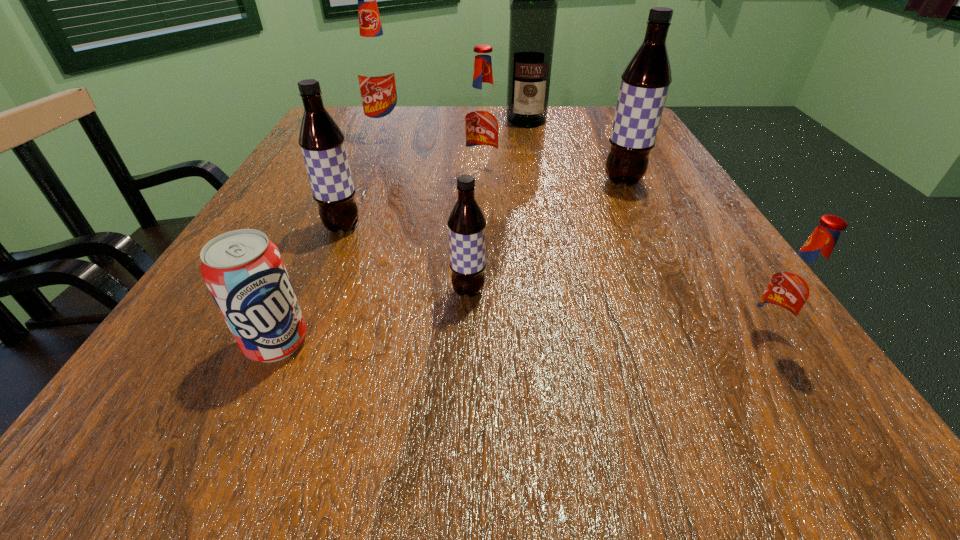
At what (x,y) coordinates should I click in order to perform the action: click on free region located 0.280m on the left of the nearest root beer. Please return your answer as a coordinate pair (x, y). Looking at the image, I should click on (529, 336).

Find the location of `vacant space located on the front of the second nearest root beer`. vacant space located on the front of the second nearest root beer is located at coordinates (467, 360).

You are a GUI agent. You are given a task and a screenshot of the screen. Output one action in this format:
    pyautogui.click(x=<x>, y=<y>)
    Task: Click on the free space located 0.060m on the back of the shortest object
    This screenshot has width=960, height=540.
    Given the screenshot: What is the action you would take?
    pyautogui.click(x=300, y=290)

Find the location of a particular element. alcohol at the far edge is located at coordinates (533, 10).

The width and height of the screenshot is (960, 540). I want to click on root beer at the far edge, so click(x=376, y=70).

Find the location of `soda can that is positioned at the left edge`. soda can that is positioned at the left edge is located at coordinates (244, 271).

This screenshot has width=960, height=540. I want to click on object that is at the far left corner, so click(x=376, y=70).

In the image, there is a desktop. Find the location of `vacant region at the far edge`. vacant region at the far edge is located at coordinates (550, 116).

I want to click on free space at the near edge, so click(x=283, y=413).

Identify the location of vacant area at the left edge of the desktop. This screenshot has width=960, height=540. (289, 249).